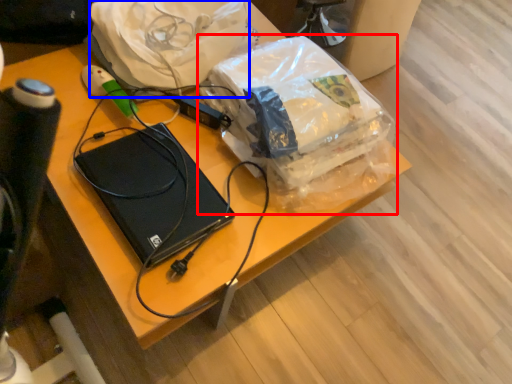
Question: Which point is closer to the camera, plastic bag (highlighted by a red box) or material (highlighted by a blue box)?

Choices:
 (A) plastic bag
 (B) material

Answer: (A)